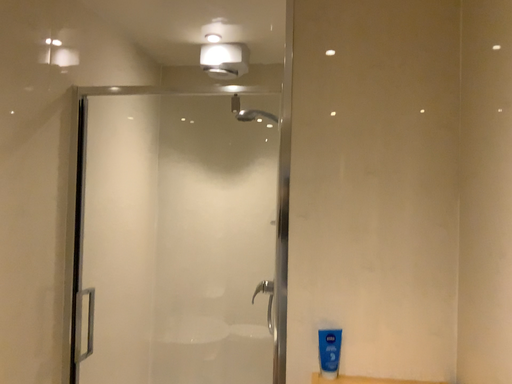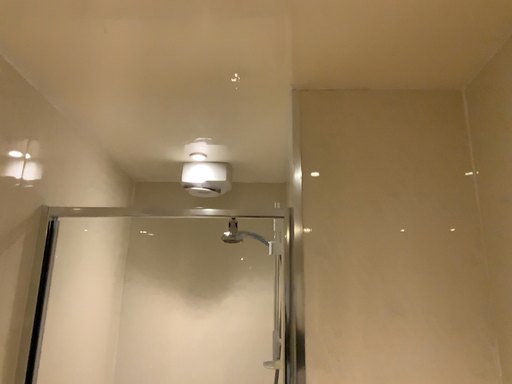
Question: Which way did the camera rotate in the video?

Choices:
 (A) rotated right
 (B) rotated left

Answer: (A)